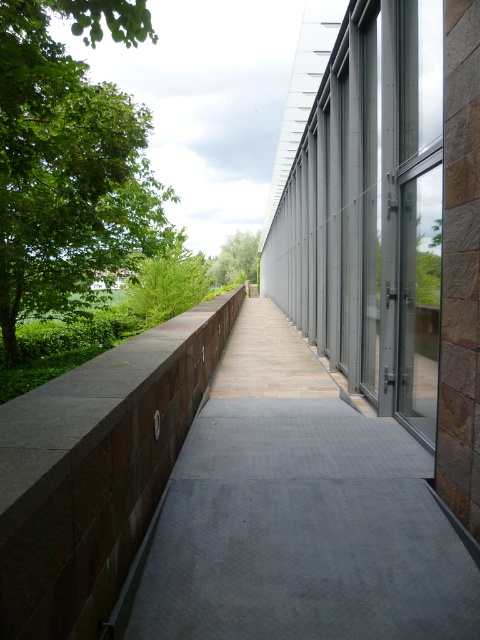
In the scene shown: Does green leafy tree at left come in front of green leafy tree at center?

Yes, it is.

Does green leafy tree at left have a lesser height compared to green leafy tree at center?

In fact, green leafy tree at left may be taller than green leafy tree at center.

Locate an element on the screen. This screenshot has height=640, width=480. green leafy tree at left is located at coordinates (69, 161).

Identify the location of green leafy tree at left. (69, 161).

Who is taller, rustic stone pavement at left or green leafy tree at left?

Standing taller between the two is green leafy tree at left.

Which is behind, point (260, 579) or point (17, 264)?

Positioned behind is point (17, 264).

What are the coordinates of `rustic stone pavement at left` in the screenshot? It's located at (299, 513).

Is rustic stone pavement at left positioned at the back of green leafy tree at center?

No, it is in front of green leafy tree at center.

Image resolution: width=480 pixels, height=640 pixels. What do you see at coordinates (299, 513) in the screenshot?
I see `rustic stone pavement at left` at bounding box center [299, 513].

The width and height of the screenshot is (480, 640). I want to click on rustic stone pavement at left, so click(x=299, y=513).

Identify the location of rustic stone pavement at left. The height and width of the screenshot is (640, 480). (299, 513).